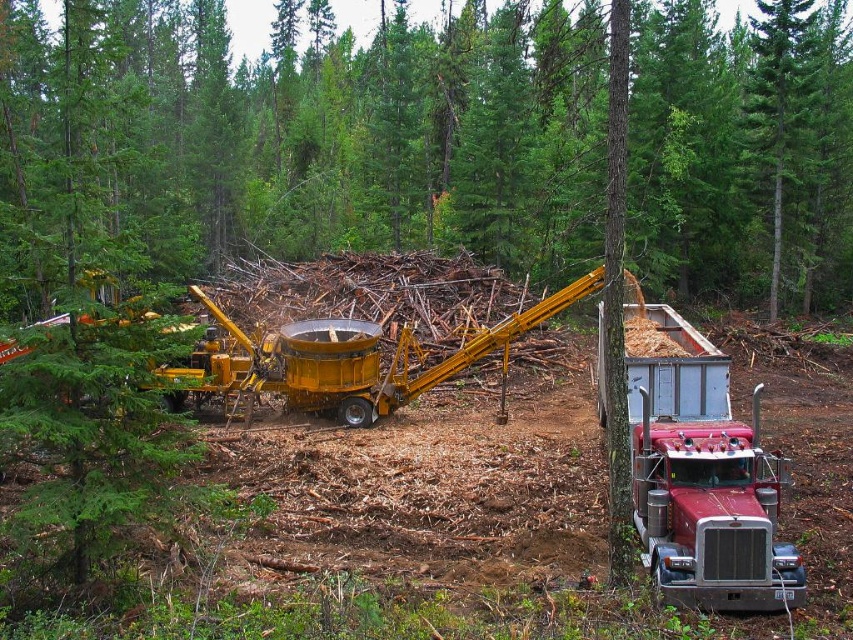
Question: Does shiny red semi-truck at lower right appear under metallic silver trailer truck at right?

Choices:
 (A) no
 (B) yes

Answer: (B)

Question: Which point is farther from the camera taking this photo?

Choices:
 (A) (770, 192)
 (B) (361, 348)
 (C) (677, 515)
 (D) (683, 326)

Answer: (A)

Question: Which object appears farthest from the camera in this image?

Choices:
 (A) green textured pine forest at center
 (B) metallic silver trailer truck at right
 (C) yellow metallic excavator at center
 (D) shiny red semi-truck at lower right

Answer: (B)

Question: Which object is the closest to the yellow metallic excavator at center?

Choices:
 (A) shiny red semi-truck at lower right
 (B) green textured pine forest at center

Answer: (A)

Question: Does green textured pine forest at center have a lesser width compared to yellow metallic excavator at center?

Choices:
 (A) yes
 (B) no

Answer: (B)

Question: Observing the image, what is the correct spatial positioning of shiny red semi-truck at lower right in reference to yellow metallic excavator at center?

Choices:
 (A) above
 (B) below

Answer: (B)